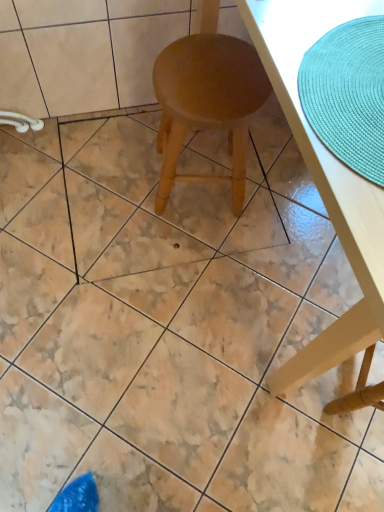
Locate an element on the screen. This screenshot has width=384, height=512. vacant area on top of light brown wood stool at center (from a real-world perspective) is located at coordinates (210, 76).